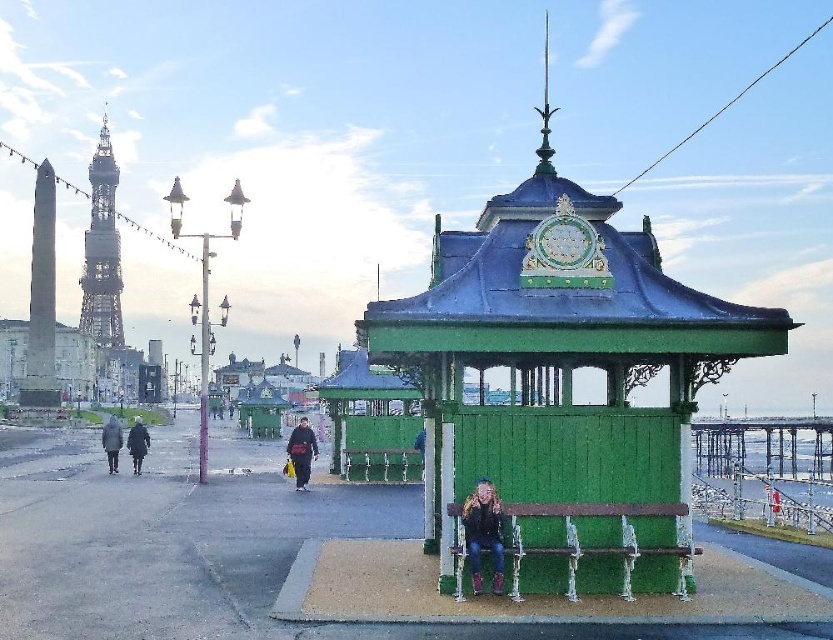
You are a tourist visiting the seaside promenade and notice a denim jacket at lower center and a green wooden bench at center. Which object is bigger in size?

The denim jacket at lower center is larger in size compared to the green wooden bench at center.

You are a photographer wanting to capture the dark gray fabric jacket at center and the green wooden bench at center in a single shot. Since you want the bench to be clearly visible, should you adjust your camera to focus on the jacket or the bench?

The dark gray fabric jacket at center is located above the green wooden bench at center. To ensure the bench is clearly visible, focus on the bench since it is below the jacket and part of the structure.

You are a photographer setting up a tripod to capture the seaside promenade scene. You need to place your equipment between the denim jacket at lower center and the green wooden bench at center. Which object should you position your tripod closer to in order to ensure there is enough space for your gear?

The denim jacket at lower center has a greater width than the green wooden bench at center. To ensure enough space for your equipment, position the tripod closer to the denim jacket at lower center.